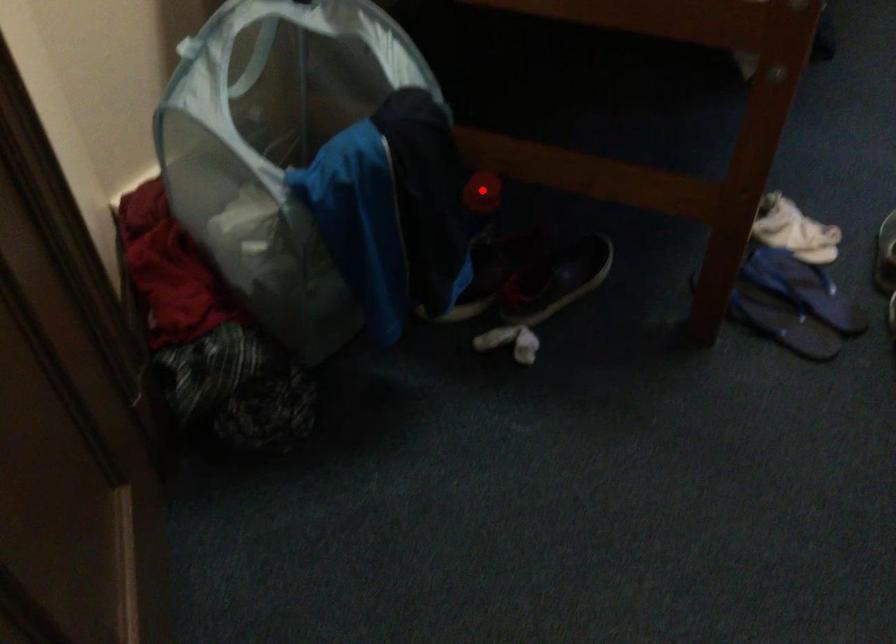
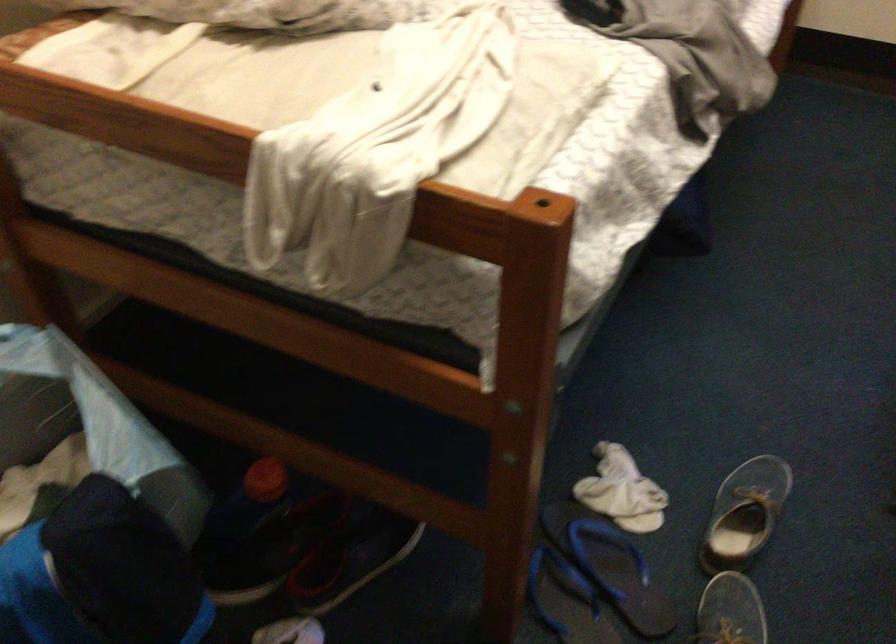
Locate, in the second image, the point that corresponds to the highlighted location in the first image.

(264, 480)